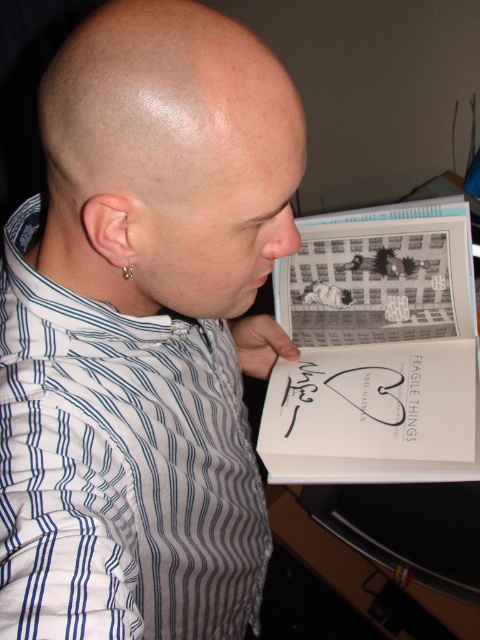
You are a fashion designer observing the person in the image. You need to decide whether the white striped shirt at center and the silver metallic earring at ear can be seen together in the same outfit. Based on their sizes, can they be visible simultaneously without one covering the other?

The white striped shirt at center has a larger size compared to silver metallic earring at ear, so they can be seen together without one covering the other.